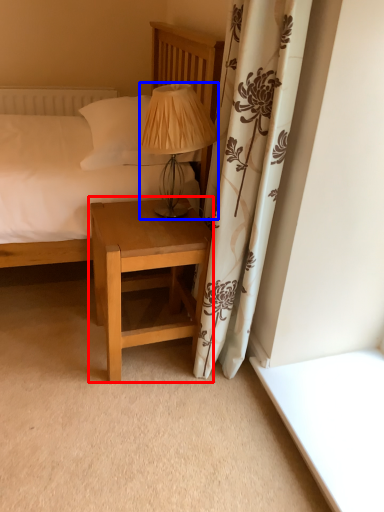
Question: Which object is further to the camera taking this photo, nightstand (highlighted by a red box) or table lamp (highlighted by a blue box)?

Choices:
 (A) nightstand
 (B) table lamp

Answer: (A)